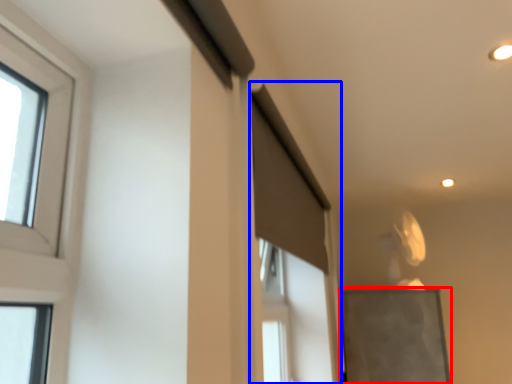
Question: Among these objects, which one is farthest to the camera, bulletin board (highlighted by a red box) or screen door (highlighted by a blue box)?

Choices:
 (A) bulletin board
 (B) screen door

Answer: (A)